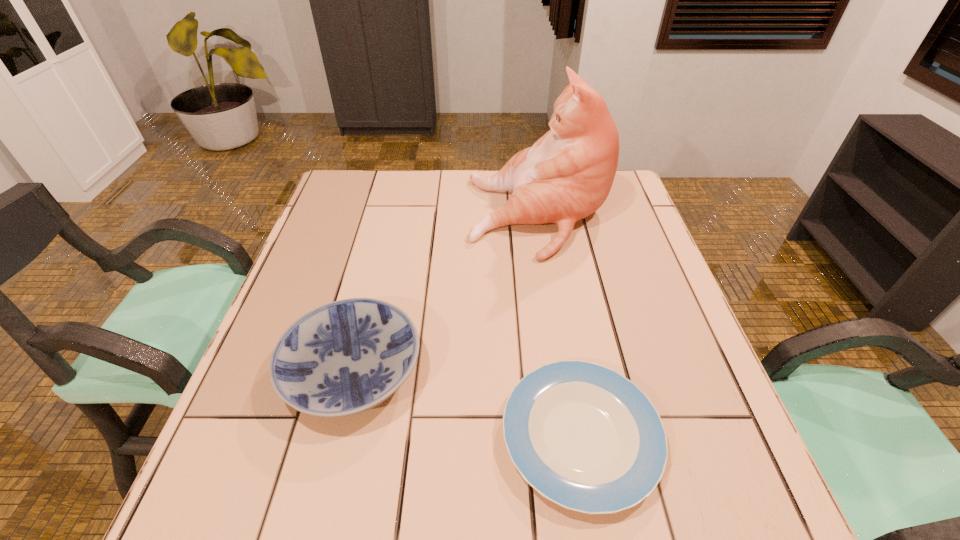
Identify the location of free region located 0.090m on the left of the shortest object. This screenshot has height=540, width=960. (452, 436).

Find the location of a particular element. Image resolution: width=960 pixels, height=540 pixels. object that is at the far edge is located at coordinates (567, 174).

Image resolution: width=960 pixels, height=540 pixels. Identify the location of object that is positioned at the near edge. (585, 437).

Find the location of a particular element. object located in the left edge section of the desktop is located at coordinates (343, 358).

Find the location of a particular element. The height and width of the screenshot is (540, 960). cat that is at the right edge is located at coordinates point(567,174).

Locate an element on the screen. plate present at the right edge is located at coordinates (585, 437).

Locate an element on the screen. The width and height of the screenshot is (960, 540). object situated at the far right corner is located at coordinates (567, 174).

Identify the location of object that is positioned at the near right corner. Image resolution: width=960 pixels, height=540 pixels. (585, 437).

I want to click on vacant space at the far edge, so click(438, 177).

This screenshot has width=960, height=540. I want to click on vacant space at the near edge of the desktop, so click(x=655, y=494).